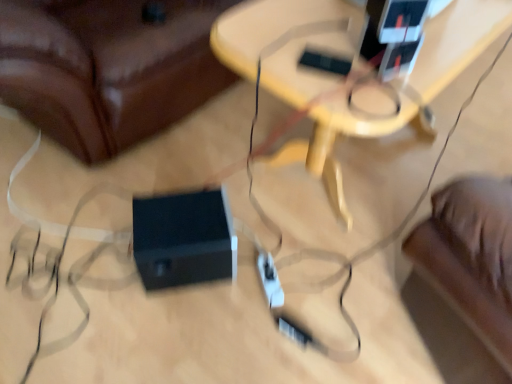
Question: From the image's perspective, is black plastic speaker at lower center positioned above or below black plastic speaker at lower center?

Choices:
 (A) above
 (B) below

Answer: (B)

Question: Is black plastic speaker at lower center situated inside black plastic speaker at lower center or outside?

Choices:
 (A) inside
 (B) outside

Answer: (B)

Question: Estimate the real-world distances between objects in this image. Which object is farther from the wooden table at center?

Choices:
 (A) black plastic speaker at lower center
 (B) black plastic speaker at lower center

Answer: (B)

Question: Which object is the farthest from the black plastic speaker at lower center?

Choices:
 (A) wooden table at center
 (B) black plastic speaker at lower center

Answer: (A)